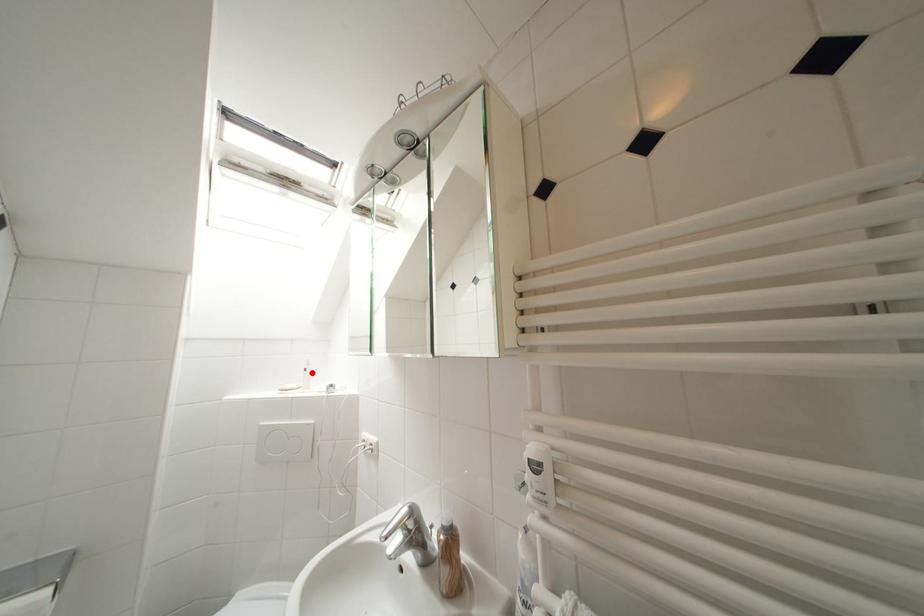
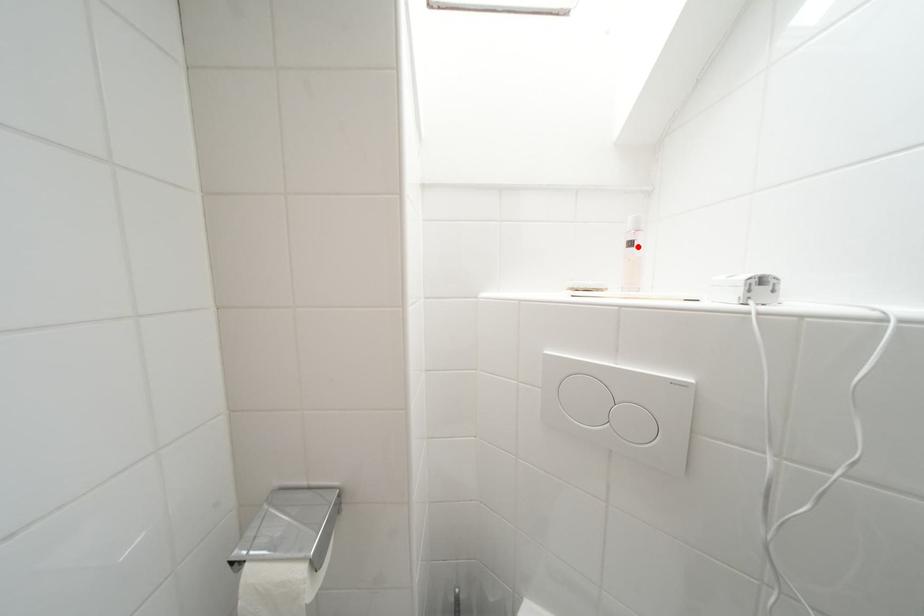
I am providing you with two images of the same scene from different viewpoints. A red point is marked on the first image and another point is marked on the second image. Are the points marked in image1 and image2 representing the same 3D position?

Yes